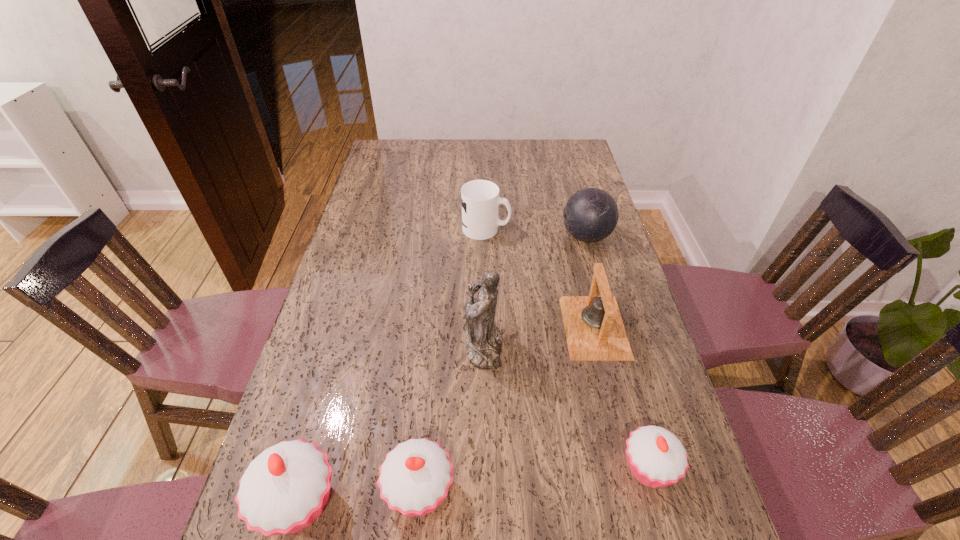
I want to click on vacant area located 0.280m on the front of the bell, so click(x=629, y=472).

Find the location of a particular element. Image resolution: width=960 pixels, height=540 pixels. free point located on the grip area of the bowling ball is located at coordinates (516, 237).

This screenshot has height=540, width=960. I want to click on free spot located on the grip area of the bowling ball, so click(483, 237).

The image size is (960, 540). In order to click on vacant position located 0.260m on the grip area of the bowling ball in this screenshot , I will do tap(483, 237).

Where is `vacant area situated 0.080m on the front-facing side of the figurine`? Image resolution: width=960 pixels, height=540 pixels. vacant area situated 0.080m on the front-facing side of the figurine is located at coordinates (434, 346).

The width and height of the screenshot is (960, 540). I want to click on free point located 0.190m on the front-facing side of the figurine, so click(392, 346).

This screenshot has height=540, width=960. Identify the location of free spot located on the front-facing side of the figurine. (392, 346).

What are the coordinates of `cupcake present at the right edge` in the screenshot? It's located at (656, 457).

This screenshot has height=540, width=960. What are the coordinates of `bell that is positioned at the right edge` in the screenshot? It's located at (594, 329).

Identify the location of bowling ball present at the right edge. This screenshot has width=960, height=540. (591, 214).